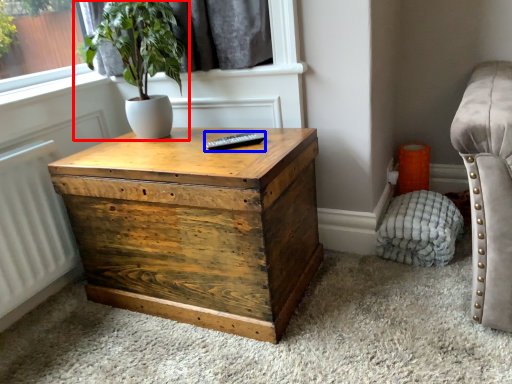
Question: Which object is further to the camera taking this photo, houseplant (highlighted by a red box) or remote (highlighted by a blue box)?

Choices:
 (A) houseplant
 (B) remote

Answer: (B)